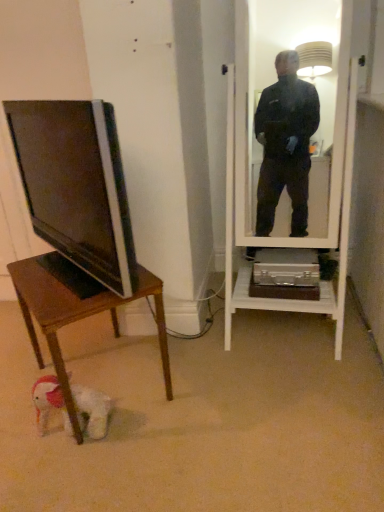
Question: Does wooden desk at lower left have a lesser width compared to white plush dog at lower left?

Choices:
 (A) yes
 (B) no

Answer: (B)

Question: Can you confirm if wooden desk at lower left is taller than white plush dog at lower left?

Choices:
 (A) no
 (B) yes

Answer: (B)

Question: From the image's perspective, would you say wooden desk at lower left is shown under white plush dog at lower left?

Choices:
 (A) yes
 (B) no

Answer: (B)

Question: Does wooden desk at lower left have a larger size compared to white plush dog at lower left?

Choices:
 (A) no
 (B) yes

Answer: (B)

Question: Is wooden desk at lower left further to camera compared to white plush dog at lower left?

Choices:
 (A) no
 (B) yes

Answer: (A)

Question: Considering the relative positions of wooden desk at lower left and white plush dog at lower left in the image provided, is wooden desk at lower left to the right of white plush dog at lower left from the viewer's perspective?

Choices:
 (A) no
 (B) yes

Answer: (B)

Question: Is the depth of matte black tv at left less than that of wooden desk at lower left?

Choices:
 (A) yes
 (B) no

Answer: (A)

Question: Can you confirm if matte black tv at left is shorter than wooden desk at lower left?

Choices:
 (A) yes
 (B) no

Answer: (B)

Question: Considering the relative sizes of matte black tv at left and wooden desk at lower left in the image provided, is matte black tv at left bigger than wooden desk at lower left?

Choices:
 (A) yes
 (B) no

Answer: (B)

Question: Does matte black tv at left touch wooden desk at lower left?

Choices:
 (A) no
 (B) yes

Answer: (A)

Question: Considering the relative positions of matte black tv at left and wooden desk at lower left in the image provided, is matte black tv at left to the left of wooden desk at lower left from the viewer's perspective?

Choices:
 (A) no
 (B) yes

Answer: (B)

Question: Considering the relative sizes of matte black tv at left and wooden desk at lower left in the image provided, is matte black tv at left thinner than wooden desk at lower left?

Choices:
 (A) yes
 (B) no

Answer: (A)

Question: Can you confirm if white plush dog at lower left is positioned to the right of matte black tv at left?

Choices:
 (A) yes
 (B) no

Answer: (A)